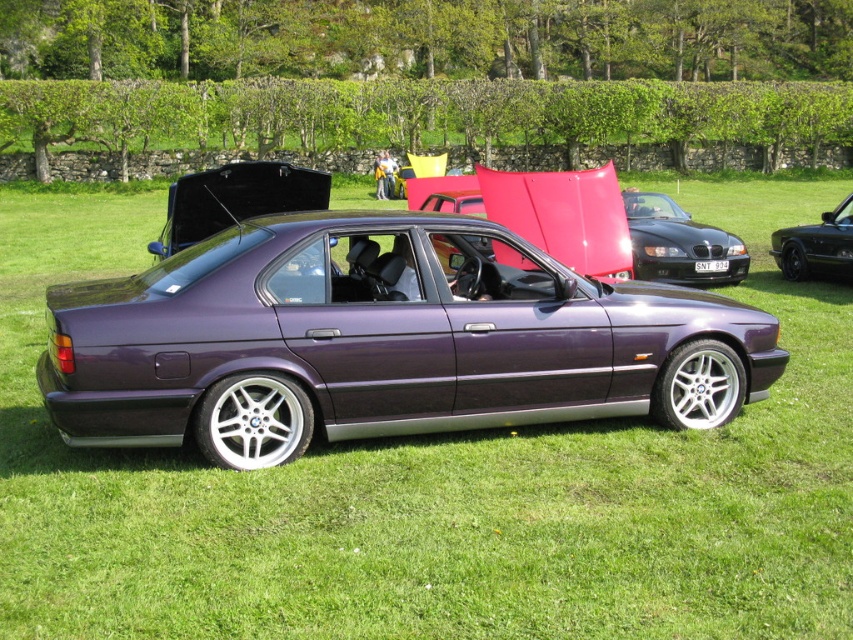
From the picture: Is metallic purple car at center below matte purple car at center?

Correct, metallic purple car at center is located below matte purple car at center.

Is metallic purple car at center to the left of matte purple car at center from the viewer's perspective?

Incorrect, metallic purple car at center is not on the left side of matte purple car at center.

Is point (413, 404) in front of point (381, 164)?

Yes, it is in front of point (381, 164).

At what (x,y) coordinates should I click in order to perform the action: click on metallic purple car at center. Please return your answer as a coordinate pair (x, y). Image resolution: width=853 pixels, height=640 pixels. Looking at the image, I should click on (364, 339).

Is purple metallic car at center positioned before silver metallic rim at lower center?

That is False.

Who is more forward, (695, 237) or (213, 438)?

Point (213, 438)

You are a GUI agent. You are given a task and a screenshot of the screen. Output one action in this format:
    pyautogui.click(x=<x>, y=<y>)
    Task: Click on the purple metallic car at center
    Image resolution: width=853 pixels, height=640 pixels.
    Given the screenshot: What is the action you would take?
    pyautogui.click(x=679, y=244)

Can you confirm if silver metallic rim at lower center is thinner than matte purple car at center?

Yes, silver metallic rim at lower center is thinner than matte purple car at center.

Based on the photo, does silver metallic rim at lower center appear over matte purple car at center?

No, silver metallic rim at lower center is not above matte purple car at center.

Find the location of a particular element. The image size is (853, 640). silver metallic rim at lower center is located at coordinates (253, 420).